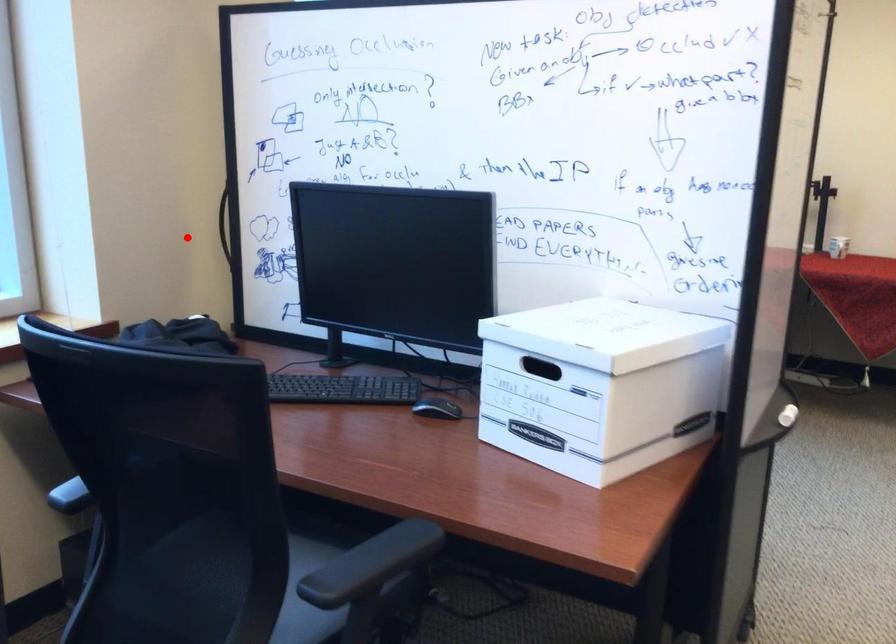
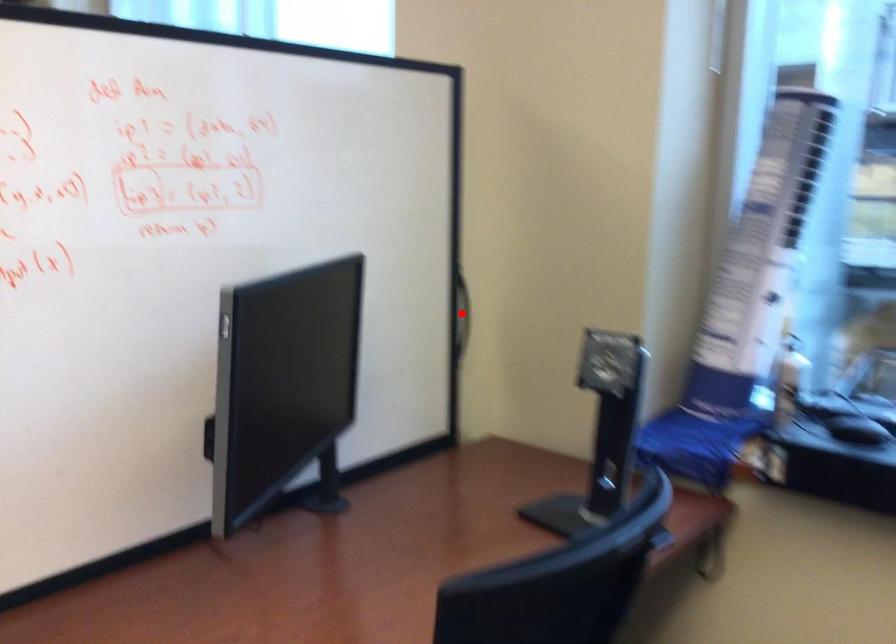
I am providing you with two images of the same scene from different viewpoints. A red point is marked on the first image and another point is marked on the second image. Are the points marked in image1 and image2 representing the same 3D position?

Yes